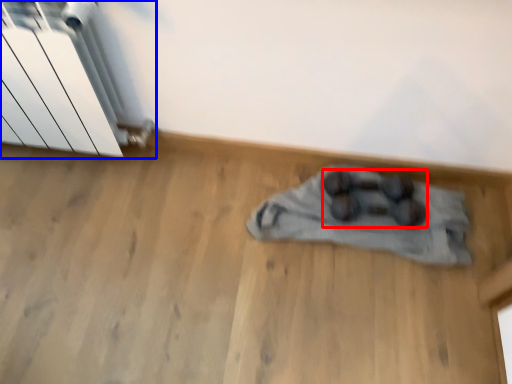
Question: Among these objects, which one is farthest to the camera, footwear (highlighted by a red box) or radiator (highlighted by a blue box)?

Choices:
 (A) footwear
 (B) radiator

Answer: (A)